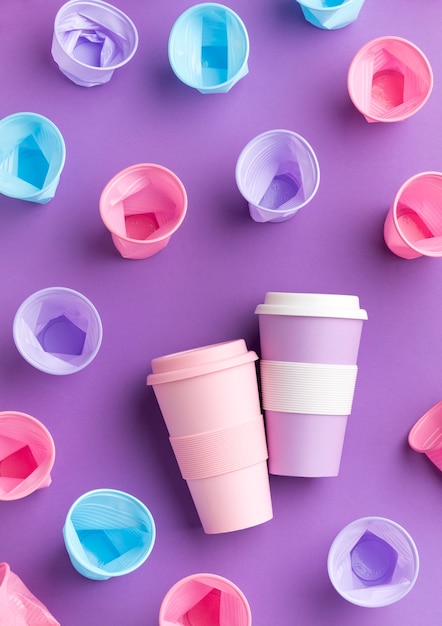
You are a GUI agent. You are given a task and a screenshot of the screen. Output one action in this format:
    pyautogui.click(x=<x>, y=<y>)
    Task: Click on the lavender cups
    
    Given the screenshot: What is the action you would take?
    pyautogui.click(x=316, y=357), pyautogui.click(x=267, y=170), pyautogui.click(x=57, y=329), pyautogui.click(x=376, y=555), pyautogui.click(x=91, y=38)